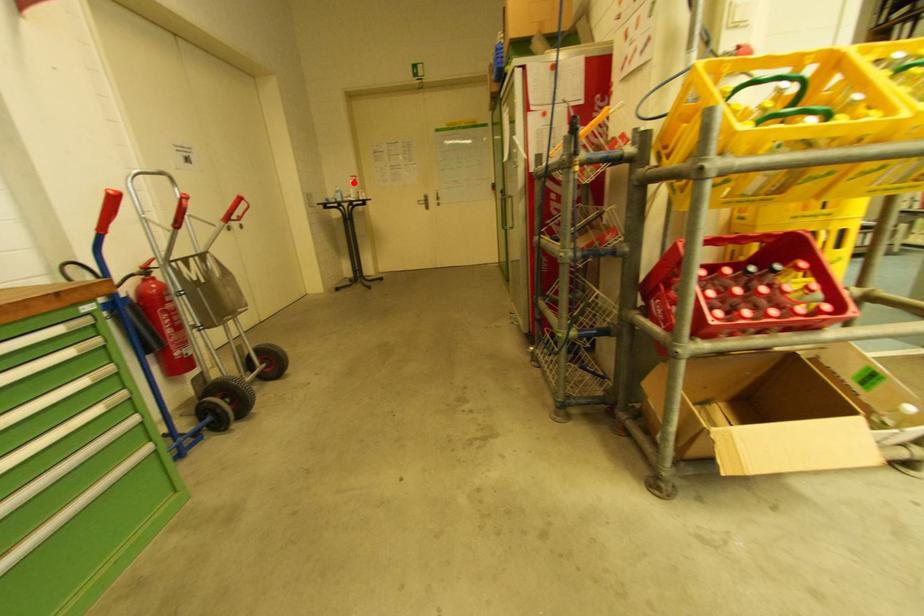
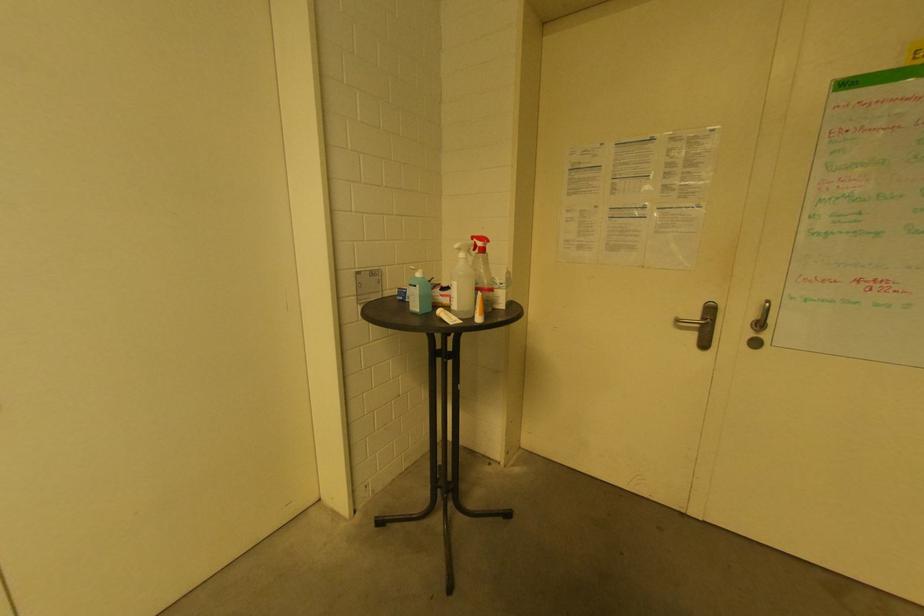
Question: I am providing you with two images of the same scene from different viewpoints. Given a red point in image1, look at the same physical point in image2. Is it:

Choices:
 (A) Closer to the viewpoint
 (B) Farther from the viewpoint

Answer: (B)